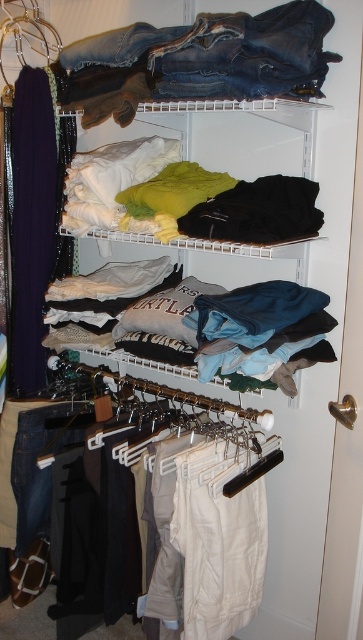
Question: Which of the following is the farthest from the observer?

Choices:
 (A) light gray cotton t-shirt at center
 (B) denim jeans at upper center

Answer: (A)

Question: Does denim jeans at upper center lie in front of light gray cotton t-shirt at center?

Choices:
 (A) yes
 (B) no

Answer: (A)

Question: Is denim jeans at upper center positioned in front of light gray cotton t-shirt at center?

Choices:
 (A) yes
 (B) no

Answer: (A)

Question: Is denim jeans at upper center thinner than light gray cotton t-shirt at center?

Choices:
 (A) no
 (B) yes

Answer: (B)

Question: Which point is closer to the camera?

Choices:
 (A) (315, 86)
 (B) (217, 330)

Answer: (A)